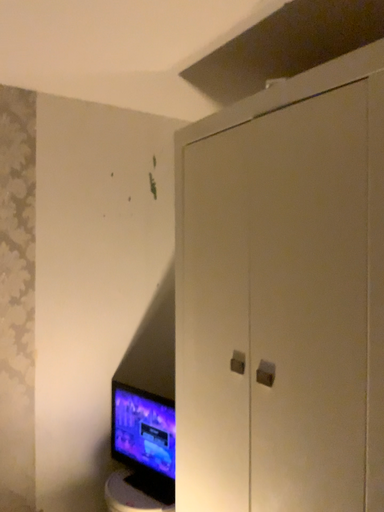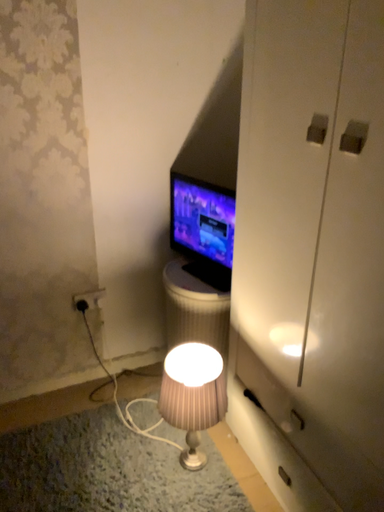
Question: Which way did the camera rotate in the video?

Choices:
 (A) rotated upward
 (B) rotated downward

Answer: (B)